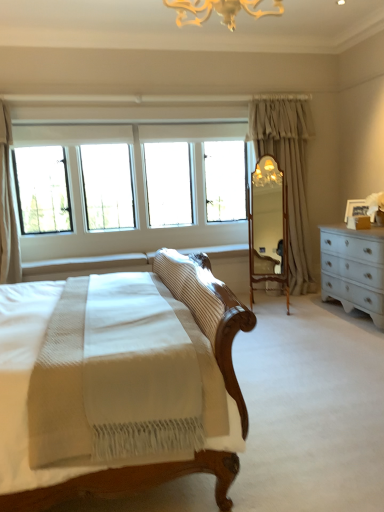
Question: From a real-world perspective, is light beige fabric curtain at center-right, the 1th curtain in the right-to-left sequence, over wooden mirror at center?

Choices:
 (A) no
 (B) yes

Answer: (B)

Question: Is the position of light beige fabric curtain at center-right, placed as the second curtain when sorted from left to right, less distant than that of wooden mirror at center?

Choices:
 (A) no
 (B) yes

Answer: (A)

Question: Does light beige fabric curtain at center-right, the 1th curtain in the right-to-left sequence, contain wooden mirror at center?

Choices:
 (A) yes
 (B) no

Answer: (B)

Question: Is light beige fabric curtain at center-right, the 1th curtain in the right-to-left sequence, shorter than wooden mirror at center?

Choices:
 (A) yes
 (B) no

Answer: (B)

Question: Can you confirm if light beige fabric curtain at center-right, placed as the second curtain when sorted from left to right, is thinner than wooden mirror at center?

Choices:
 (A) no
 (B) yes

Answer: (A)

Question: From the image's perspective, is light beige fabric curtain at center-right, the 1th curtain in the right-to-left sequence, located beneath wooden mirror at center?

Choices:
 (A) no
 (B) yes

Answer: (A)

Question: From a real-world perspective, is light beige fabric curtain at center-right, which ranks as the 2th curtain in front-to-back order, physically above clear glass windows at upper left?

Choices:
 (A) yes
 (B) no

Answer: (B)

Question: Considering the relative sizes of light beige fabric curtain at center-right, placed as the second curtain when sorted from left to right, and clear glass windows at upper left in the image provided, is light beige fabric curtain at center-right, placed as the second curtain when sorted from left to right, shorter than clear glass windows at upper left?

Choices:
 (A) no
 (B) yes

Answer: (A)

Question: Can you confirm if light beige fabric curtain at center-right, the 1th curtain in the right-to-left sequence, is positioned to the right of clear glass windows at upper left?

Choices:
 (A) yes
 (B) no

Answer: (A)

Question: Is light beige fabric curtain at center-right, which ranks as the 2th curtain in front-to-back order, taller than clear glass windows at upper left?

Choices:
 (A) yes
 (B) no

Answer: (A)

Question: Could you tell me if light beige fabric curtain at center-right, placed as the second curtain when sorted from left to right, is turned towards clear glass windows at upper left?

Choices:
 (A) yes
 (B) no

Answer: (B)

Question: Considering the relative sizes of light beige fabric curtain at center-right, the 1th curtain in the right-to-left sequence, and clear glass windows at upper left in the image provided, is light beige fabric curtain at center-right, the 1th curtain in the right-to-left sequence, thinner than clear glass windows at upper left?

Choices:
 (A) yes
 (B) no

Answer: (B)

Question: Is wooden mirror at center to the left of white textured curtain at upper left, which is the second curtain from right to left, from the viewer's perspective?

Choices:
 (A) no
 (B) yes

Answer: (A)